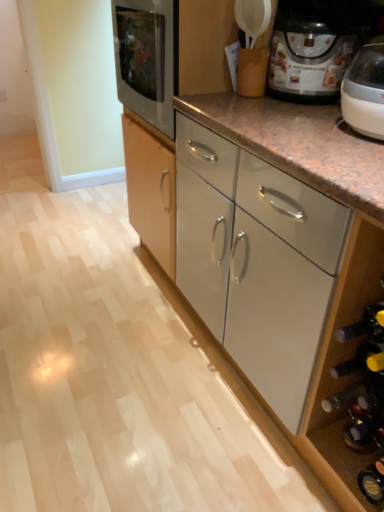
Question: Could you tell me if white glossy cabinet at center is turned towards matte black wine bottle at lower right?

Choices:
 (A) no
 (B) yes

Answer: (A)

Question: Is white glossy cabinet at center completely or partially outside of matte black wine bottle at lower right?

Choices:
 (A) yes
 (B) no

Answer: (A)

Question: Is white glossy cabinet at center behind matte black wine bottle at lower right?

Choices:
 (A) yes
 (B) no

Answer: (A)

Question: Can you confirm if white glossy cabinet at center is bigger than matte black wine bottle at lower right?

Choices:
 (A) yes
 (B) no

Answer: (A)

Question: Is white glossy cabinet at center to the right of matte black wine bottle at lower right from the viewer's perspective?

Choices:
 (A) yes
 (B) no

Answer: (B)

Question: Are white glossy cabinet at center and matte black wine bottle at lower right making contact?

Choices:
 (A) yes
 (B) no

Answer: (B)

Question: Does matte black wine bottle at lower right have a lesser width compared to white glossy cabinet at center?

Choices:
 (A) yes
 (B) no

Answer: (A)

Question: Does matte black wine bottle at lower right have a larger size compared to white glossy cabinet at center?

Choices:
 (A) yes
 (B) no

Answer: (B)

Question: Is matte black wine bottle at lower right facing away from white glossy cabinet at center?

Choices:
 (A) yes
 (B) no

Answer: (B)

Question: Can you confirm if matte black wine bottle at lower right is taller than white glossy cabinet at center?

Choices:
 (A) yes
 (B) no

Answer: (A)

Question: Is white glossy cabinet at center located within matte black wine bottle at lower right?

Choices:
 (A) yes
 (B) no

Answer: (B)

Question: Is matte black wine bottle at lower right not close to white glossy cabinet at center?

Choices:
 (A) yes
 (B) no

Answer: (B)

Question: Is matte black wine bottle at lower right at the left side of matte black coffee maker at upper right?

Choices:
 (A) no
 (B) yes

Answer: (B)